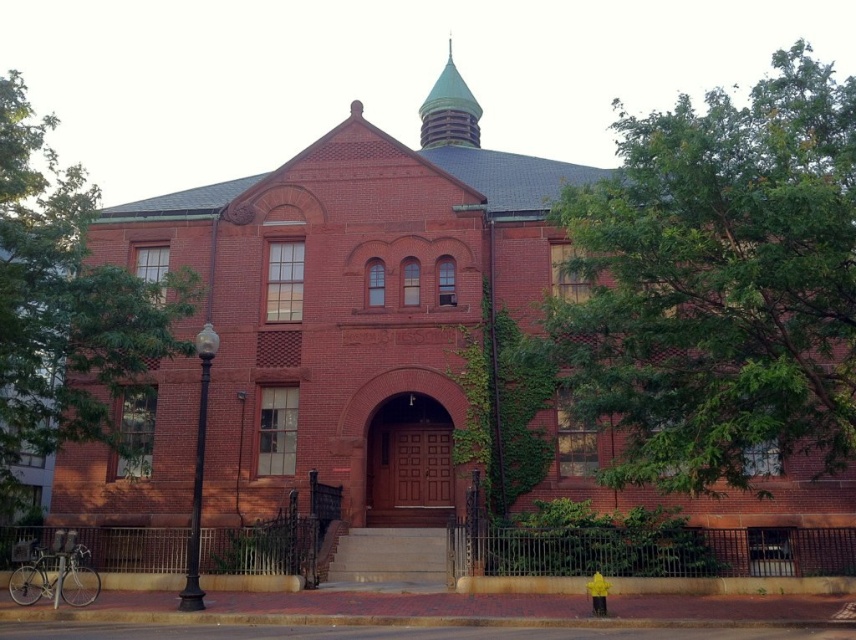
Question: Which object is positioned closest to the green leafy tree at left?

Choices:
 (A) green leafy tree at upper right
 (B) green copper spire at upper center

Answer: (A)

Question: Which point is closer to the camera taking this photo?

Choices:
 (A) (428, 112)
 (B) (3, 472)
 (C) (716, 272)

Answer: (C)

Question: Is the position of green leafy tree at upper right more distant than that of green copper spire at upper center?

Choices:
 (A) yes
 (B) no

Answer: (B)

Question: Is green leafy tree at upper right to the left of green leafy tree at left from the viewer's perspective?

Choices:
 (A) yes
 (B) no

Answer: (B)

Question: Among these points, which one is farthest from the camera?

Choices:
 (A) (431, 134)
 (B) (699, 333)

Answer: (A)

Question: From the image, what is the correct spatial relationship of green leafy tree at upper right in relation to green copper spire at upper center?

Choices:
 (A) left
 (B) right

Answer: (B)